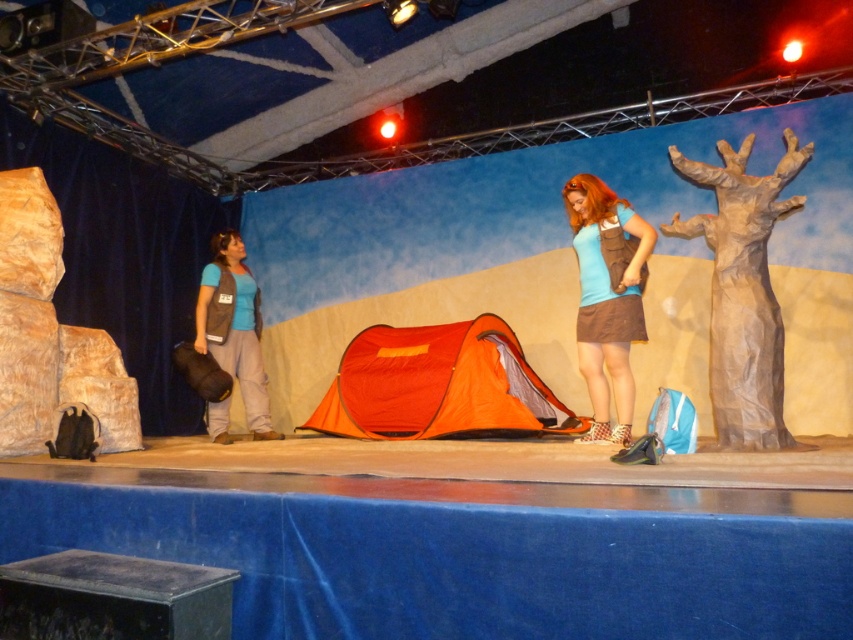
You are an actor backstage preparing for your scene. You need to retrieve your matte gray vest at left from the stage. However, there is a matte brown backpack at center blocking your path. Can you reach your vest without moving the backpack?

The matte brown backpack at center is positioned over the matte gray vest at left, so it is blocking the vest. You will need to move the backpack to access the vest.

You are an actor backstage preparing for your scene. You need to quickly grab either the matte brown backpack at center or the matte gray vest at left. Which item is easier to carry through a narrow doorway that is only 10 cm thick?

The matte brown backpack at center is thinner than the matte gray vest at left, so it would be easier to carry through the narrow doorway that is only 10 cm thick.